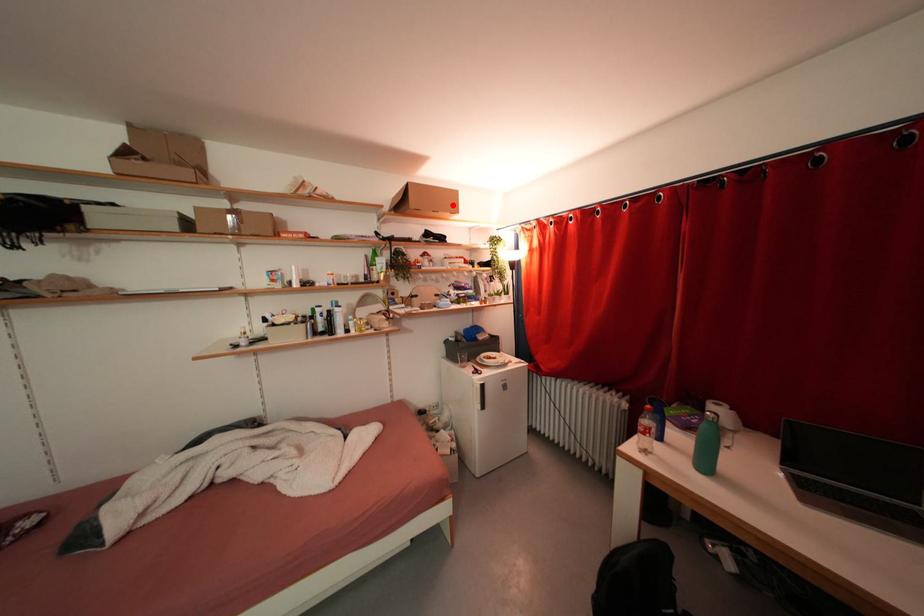
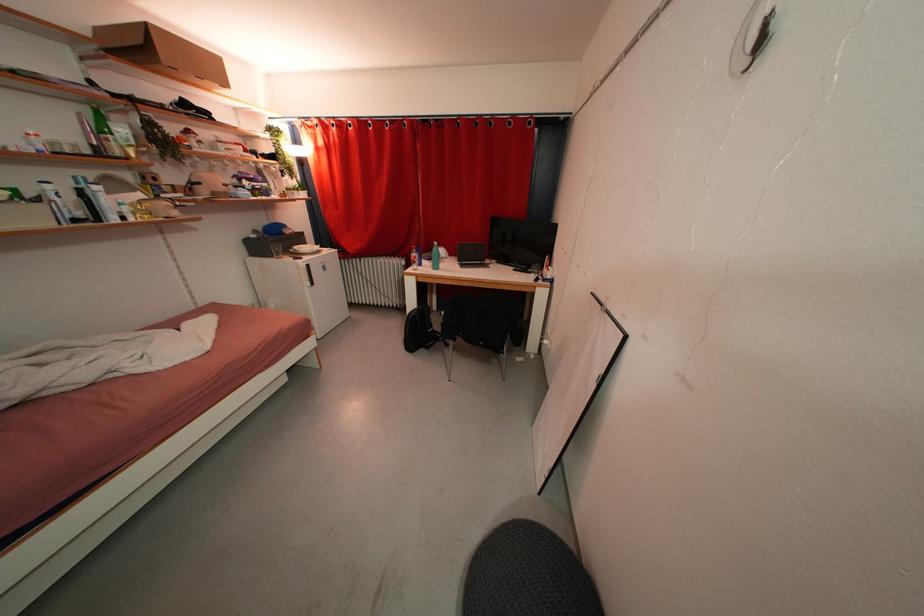
Where in the second image is the point corresponding to the highlighted location from the first image?

(214, 71)